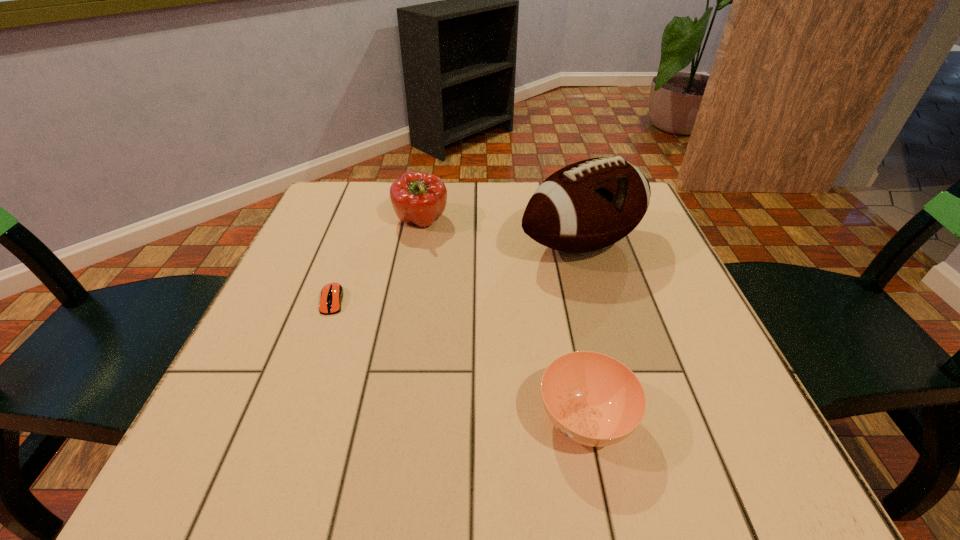
You are a GUI agent. You are given a task and a screenshot of the screen. Output one action in this format:
    pyautogui.click(x=<x>, y=<y>)
    Task: Click on the free spot between the shortest object and the second object from left to right
    The image size is (960, 540).
    Given the screenshot: What is the action you would take?
    pyautogui.click(x=377, y=261)

Find the location of a particular element. The width and height of the screenshot is (960, 540). free spot between the second object from left to right and the computer mouse is located at coordinates (377, 261).

The height and width of the screenshot is (540, 960). I want to click on object identified as the third closest to the nearest object, so click(x=417, y=197).

Where is `object that is the second nearest to the soup bowl`? object that is the second nearest to the soup bowl is located at coordinates (331, 296).

Locate an element on the screen. vacant space that satisfies the following two spatial constraints: 1. on the front side of the tallest object; 2. on the right side of the second tallest object is located at coordinates (418, 244).

Identify the location of free location that satisfies the following two spatial constraints: 1. on the front side of the third shortest object; 2. on the right side of the football (American). (418, 244).

Identify the location of vacant space that satisfies the following two spatial constraints: 1. on the front side of the third object from right to left; 2. on the right side of the tallest object. The width and height of the screenshot is (960, 540). pyautogui.click(x=418, y=244).